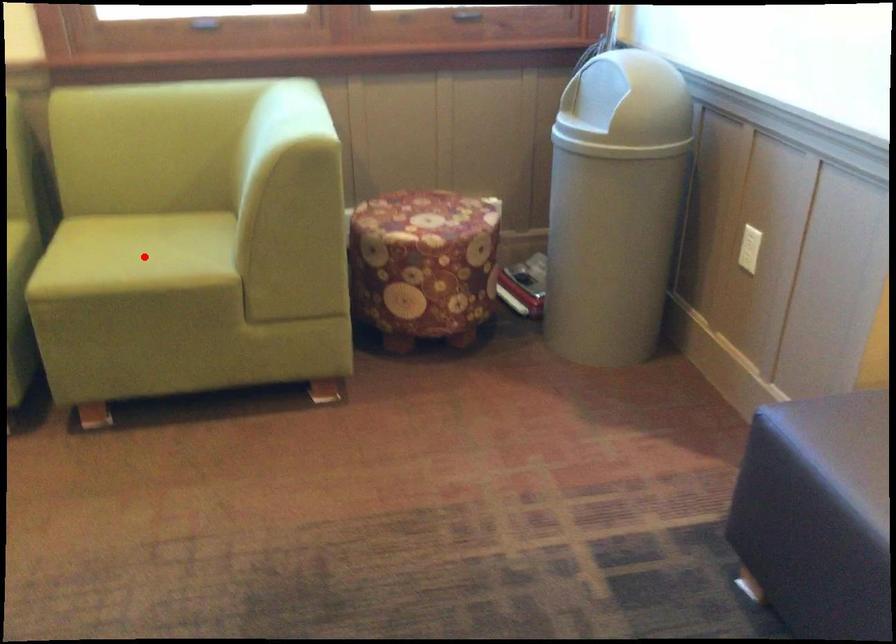
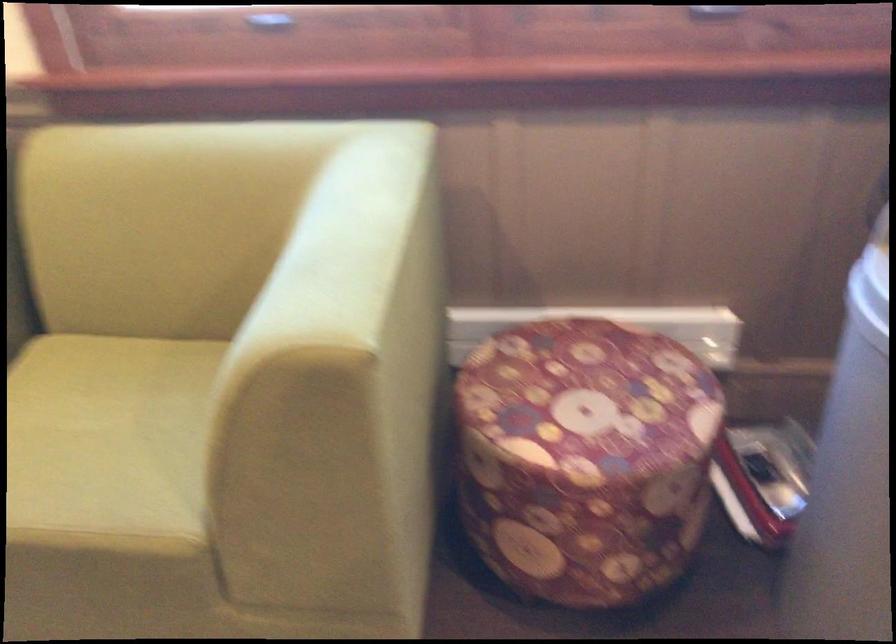
Locate, in the second image, the point that corresponds to the highlighted location in the first image.

(107, 442)